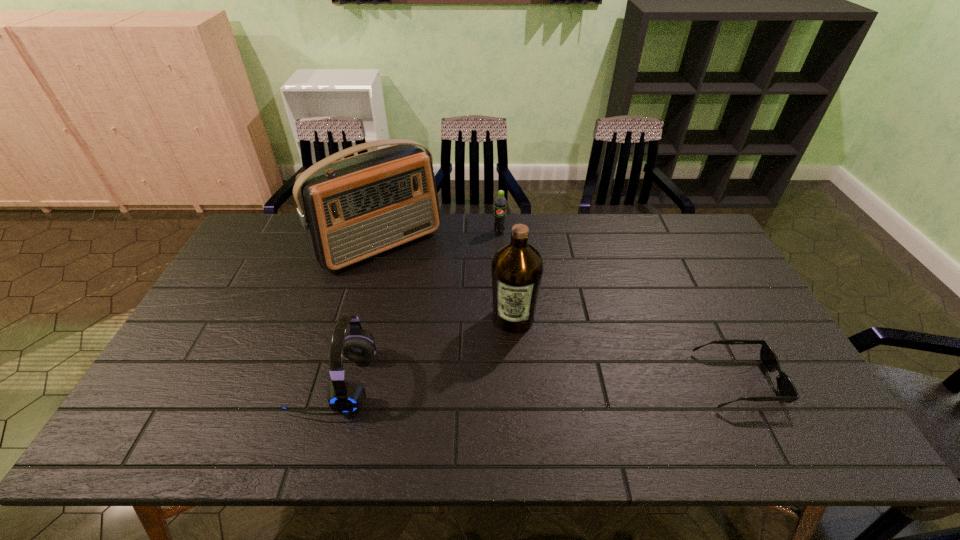
Where is `free spot on the desktop that is between the third tallest object and the shortest object and is positioned on the front label of the second shortest object`? Image resolution: width=960 pixels, height=540 pixels. free spot on the desktop that is between the third tallest object and the shortest object and is positioned on the front label of the second shortest object is located at coordinates (488, 381).

Locate an element on the screen. The height and width of the screenshot is (540, 960). vacant space on the desktop that is between the headset and the rightmost object and is positioned on the label of the third nearest object is located at coordinates (504, 381).

This screenshot has height=540, width=960. In order to click on free space on the desktop that is between the headset and the sunglasses and is positioned on the front-facing side of the radio receiver in this screenshot , I will do `click(494, 381)`.